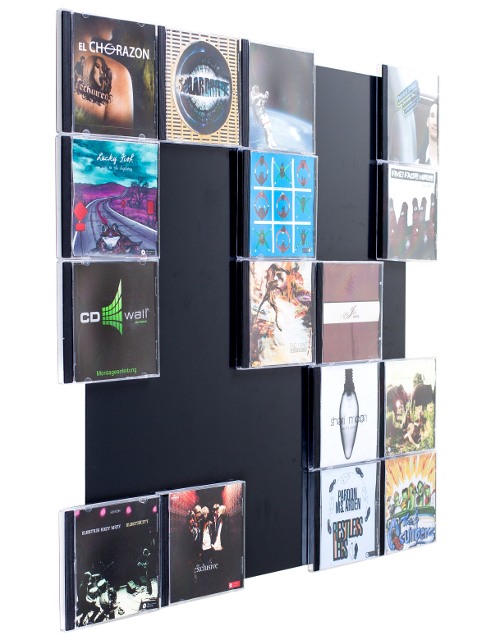
The height and width of the screenshot is (640, 500). Identify the location of light bulb. pos(346,436).